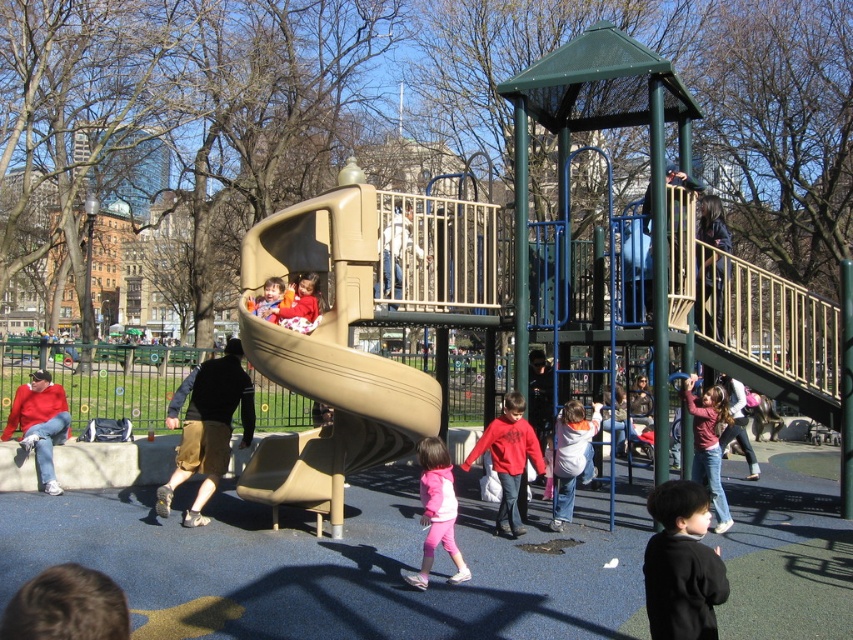
Is black matte jacket at lower right above matte plastic slide at center?

No.

Which is more to the left, black matte jacket at lower right or matte plastic slide at center?

Positioned to the left is matte plastic slide at center.

Does point (674, 593) come behind point (303, 294)?

No, it is not.

Where is `black matte jacket at lower right`? black matte jacket at lower right is located at coordinates (682, 564).

Is point (450, 580) positioned behind point (699, 419)?

No, it is not.

You are a GUI agent. You are given a task and a screenshot of the screen. Output one action in this format:
    pyautogui.click(x=<x>, y=<y>)
    Task: Click on the pink fleece jacket at center
    
    Given the screenshot: What is the action you would take?
    pyautogui.click(x=437, y=512)

Does white cotton hoodie at center have a greater width compared to light pink fabric at right?

No.

Is white cotton hoodie at center thinner than light pink fabric at right?

Correct, white cotton hoodie at center's width is less than light pink fabric at right's.

In order to click on white cotton hoodie at center in this screenshot , I will do `click(572, 456)`.